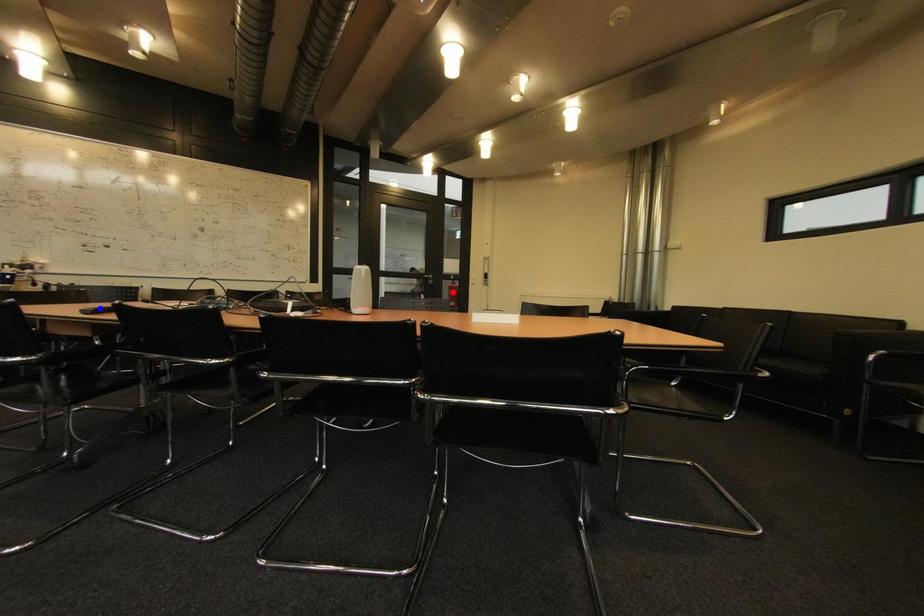
Question: In the image, two points are highlighted. Which point is nearer to the camera? Reply with the corresponding letter.

Choices:
 (A) blue point
 (B) red point

Answer: (A)